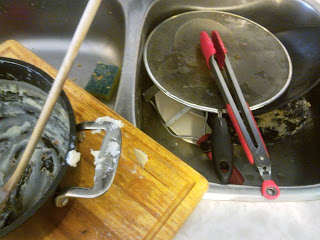
The width and height of the screenshot is (320, 240). In order to click on black handle in this screenshot , I will do `click(222, 146)`.